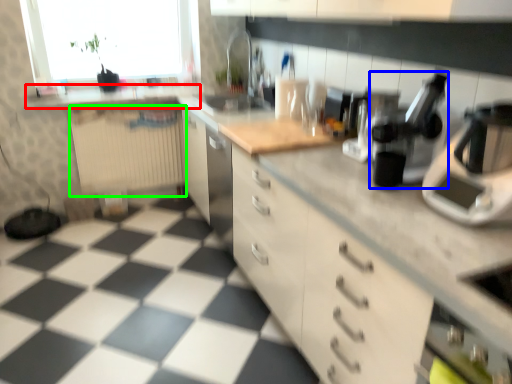
Question: Considering the real-world distances, which object is closest to counter top (highlighted by a red box)? coffee machine (highlighted by a blue box) or radiator (highlighted by a green box).

Choices:
 (A) coffee machine
 (B) radiator

Answer: (B)